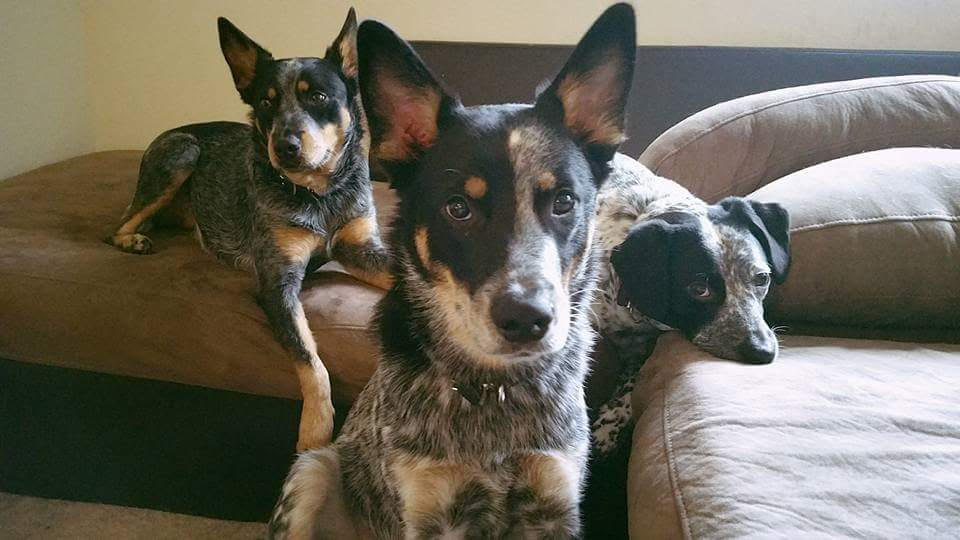
This screenshot has width=960, height=540. I want to click on dog's back right foot on couch, so click(139, 241).